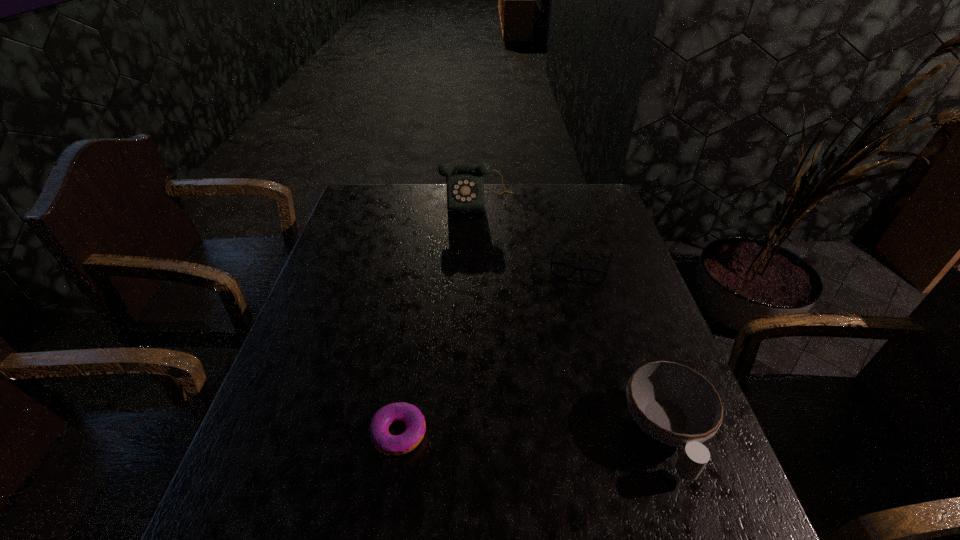
Find the location of `vacant area that lies between the chinaware and the tallest object`. vacant area that lies between the chinaware and the tallest object is located at coordinates (572, 317).

Find the location of a particular element. This screenshot has height=540, width=960. free space between the telephone and the chinaware is located at coordinates (572, 317).

This screenshot has width=960, height=540. Identify the location of free space between the spectacles and the farthest object. (529, 233).

Locate an element on the screen. The image size is (960, 540). free space between the spectacles and the second tallest object is located at coordinates (624, 349).

Find the location of a particular element. The width and height of the screenshot is (960, 540). object that is the second closest to the chinaware is located at coordinates (394, 445).

At what (x,y) coordinates should I click in order to perform the action: click on object that can be found as the second closest to the second shortest object. Please return your answer as a coordinate pair (x, y). This screenshot has height=540, width=960. Looking at the image, I should click on (674, 404).

Image resolution: width=960 pixels, height=540 pixels. Identify the location of vacant space that satisfies the following two spatial constraints: 1. on the back side of the shortest object; 2. on the left side of the third tallest object. (424, 265).